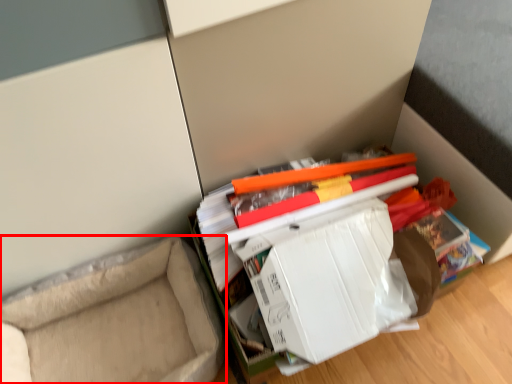
Question: From the image's perspective, what is the correct spatial positioning of furniture (annotated by the red box) in reference to paperback book?

Choices:
 (A) below
 (B) above

Answer: (A)